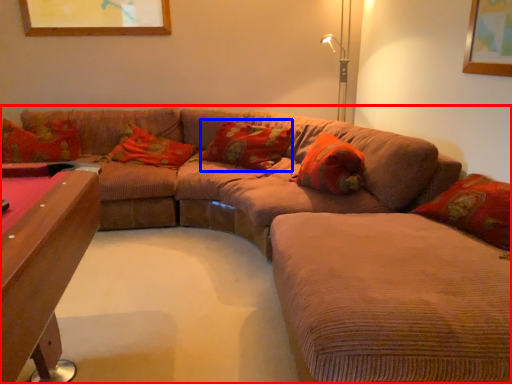
Question: Which of the following is the farthest to the observer, studio couch (highlighted by a red box) or pillow (highlighted by a blue box)?

Choices:
 (A) studio couch
 (B) pillow

Answer: (B)